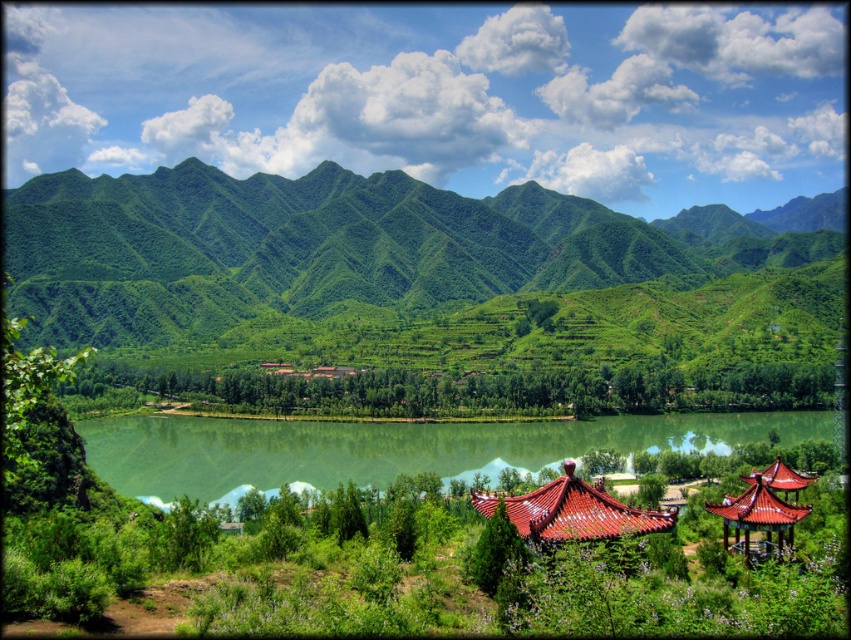
Between green textured mountain at center and shiny red tile gazebo at center, which one has more height?

Standing taller between the two is green textured mountain at center.

Is point (33, 241) positioned behind point (594, 524)?

Yes, it is behind point (594, 524).

You are a GUI agent. You are given a task and a screenshot of the screen. Output one action in this format:
    pyautogui.click(x=<x>, y=<y>)
    Task: Click on the green textured mountain at center
    
    Given the screenshot: What is the action you would take?
    pyautogui.click(x=335, y=248)

You are a GUI agent. You are given a task and a screenshot of the screen. Output one action in this format:
    pyautogui.click(x=<x>, y=<y>)
    Task: Click on the green textured mountain at center
    
    Given the screenshot: What is the action you would take?
    pyautogui.click(x=335, y=248)

Which is above, green smooth water at center or shiny red roof gazebo at lower right?

shiny red roof gazebo at lower right

Is green smooth water at center thinner than shiny red roof gazebo at lower right?

No.

Which is behind, point (255, 442) or point (770, 468)?

Point (255, 442)

Identify the location of green smooth water at center. (389, 448).

This screenshot has width=851, height=640. What do you see at coordinates (574, 512) in the screenshot?
I see `shiny red tile gazebo at center` at bounding box center [574, 512].

Between shiny red tile gazebo at center and shiny red roof gazebo at lower right, which one appears on the left side from the viewer's perspective?

shiny red tile gazebo at center

Does point (553, 493) come closer to viewer compared to point (775, 506)?

Yes, point (553, 493) is closer to viewer.

You are a GUI agent. You are given a task and a screenshot of the screen. Output one action in this format:
    pyautogui.click(x=<x>, y=<y>)
    Task: Click on the shiny red tile gazebo at center
    
    Given the screenshot: What is the action you would take?
    pyautogui.click(x=574, y=512)